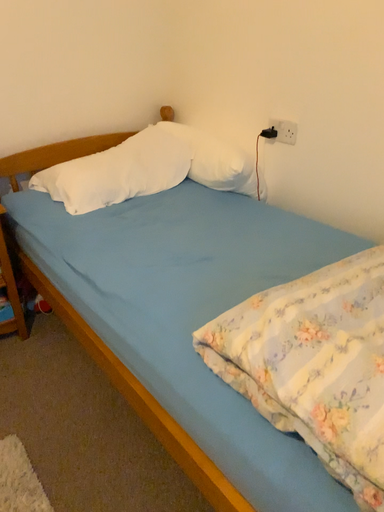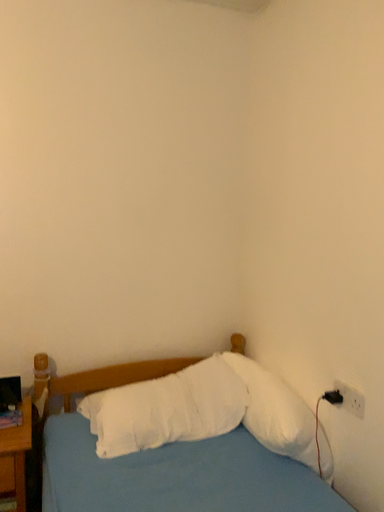
Question: Which way did the camera rotate in the video?

Choices:
 (A) rotated downward
 (B) rotated upward

Answer: (B)